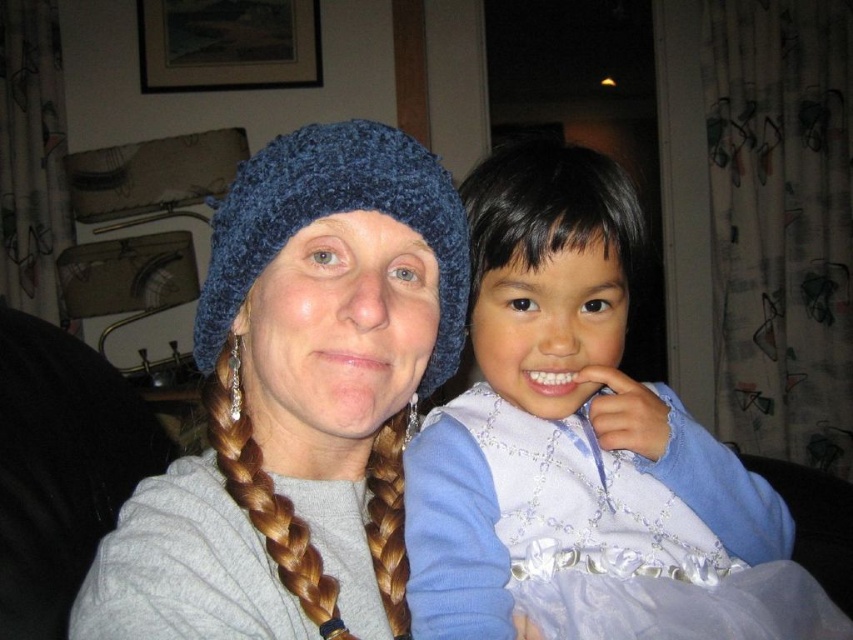
Question: Is light blue satin dress at center to the right of brown braided hair at left from the viewer's perspective?

Choices:
 (A) yes
 (B) no

Answer: (A)

Question: Is light blue satin dress at center behind light blue satin dress at right?

Choices:
 (A) yes
 (B) no

Answer: (A)

Question: Which point appears closest to the camera in this image?

Choices:
 (A) (485, 532)
 (B) (259, 365)

Answer: (B)

Question: Is the position of light blue satin dress at right less distant than that of brown braided hair at left?

Choices:
 (A) no
 (B) yes

Answer: (B)

Question: Which of these objects is positioned closest to the blue knitted beanie at center?

Choices:
 (A) blue knitted hat at upper left
 (B) brown braided hair at left
 (C) light blue satin dress at right

Answer: (A)

Question: Which point is closer to the camera taking this photo?

Choices:
 (A) (461, 538)
 (B) (312, 179)

Answer: (B)